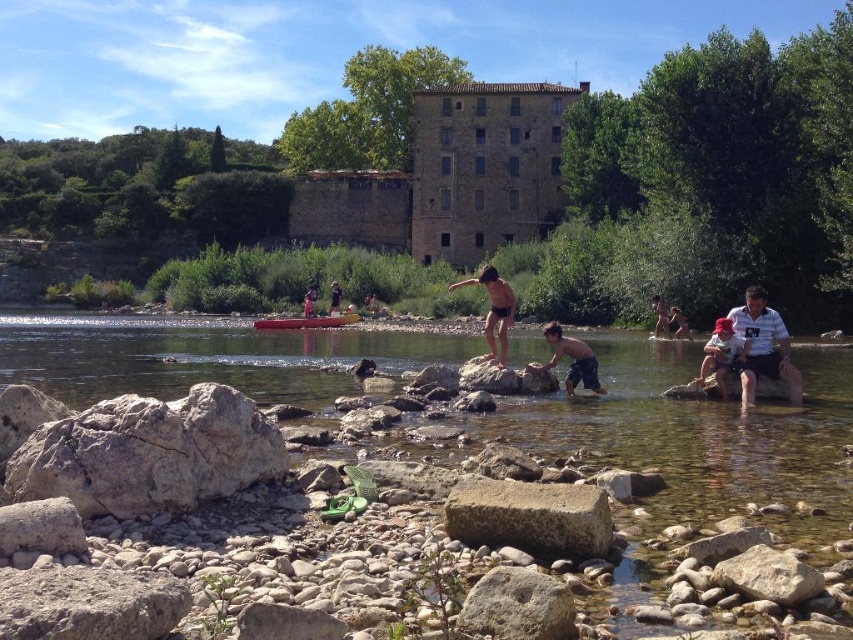
Question: Is smooth rock creek at center wider than shiny black shorts at center?

Choices:
 (A) no
 (B) yes

Answer: (B)

Question: Which object appears farthest from the camera in this image?

Choices:
 (A) white striped shirt at right
 (B) smooth plastic boat at center
 (C) smooth rock creek at center
 (D) light brown wooden paddle at center

Answer: (D)

Question: Which point is closer to the camera?

Choices:
 (A) light brown wooden paddle at center
 (B) matte black shorts at center
 (C) gray concrete block at lower center

Answer: (C)

Question: Does shiny black shorts at center have a lesser width compared to light brown wooden paddle at center?

Choices:
 (A) yes
 (B) no

Answer: (B)

Question: Is gray concrete block at lower center positioned in front of matte black shorts at center?

Choices:
 (A) yes
 (B) no

Answer: (A)

Question: Which point appears closest to the camera in this image?

Choices:
 (A) (547, 324)
 (B) (521, 545)
 (C) (502, 300)

Answer: (B)